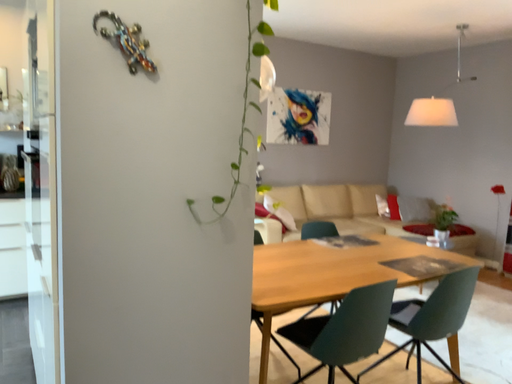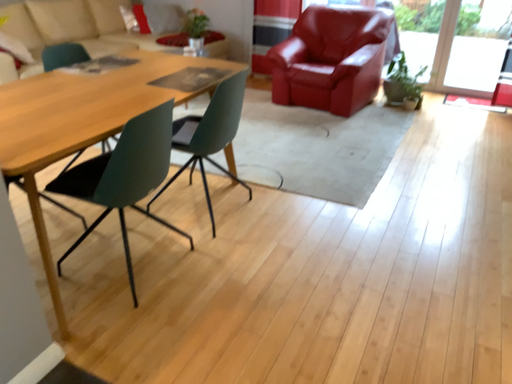
Question: Which way did the camera rotate in the video?

Choices:
 (A) rotated downward
 (B) rotated upward

Answer: (A)